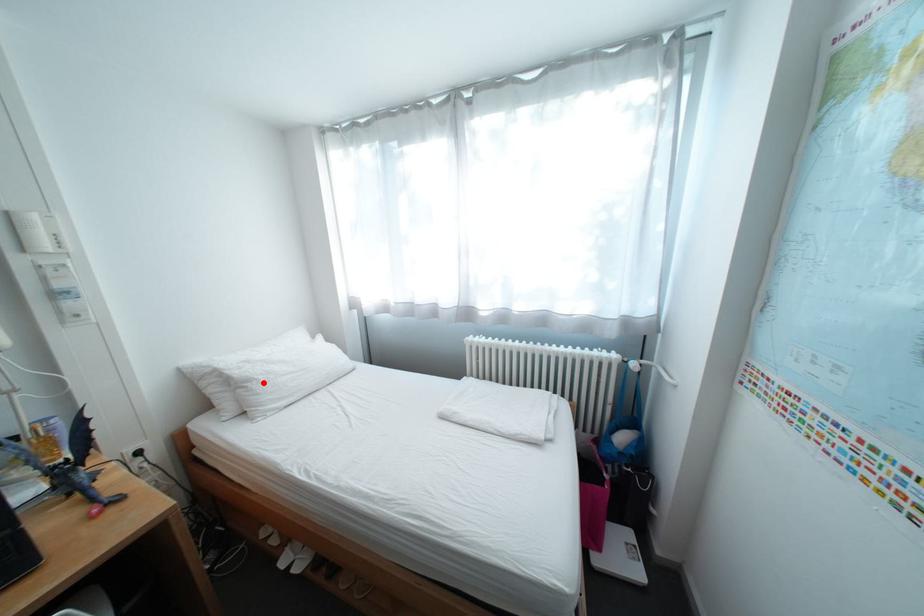
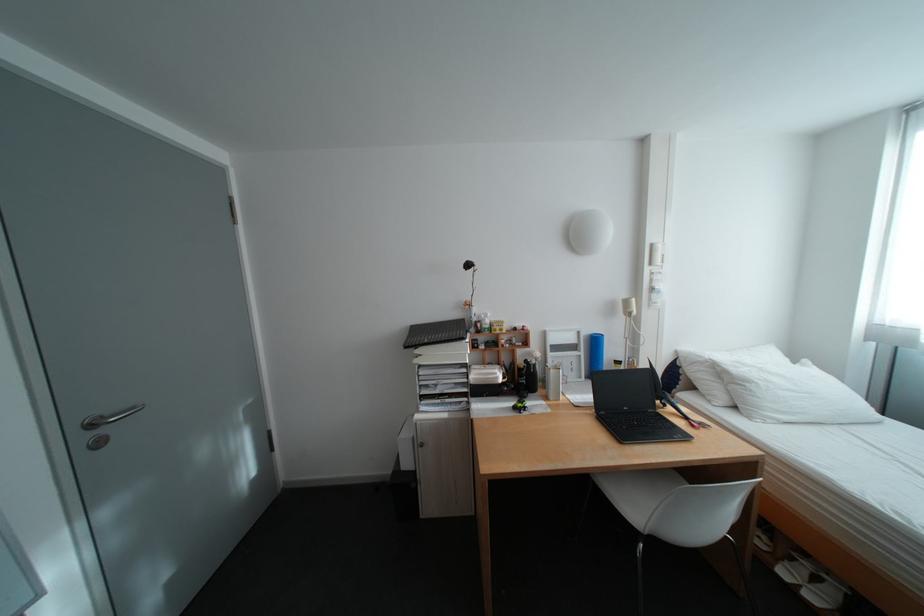
Locate, in the second image, the point that corresponds to the highlighted location in the first image.

(761, 384)